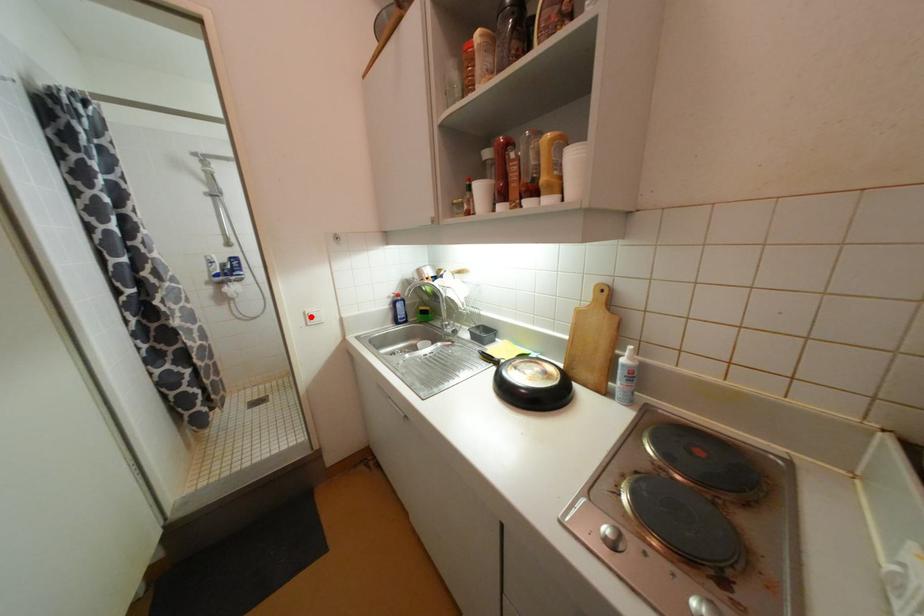
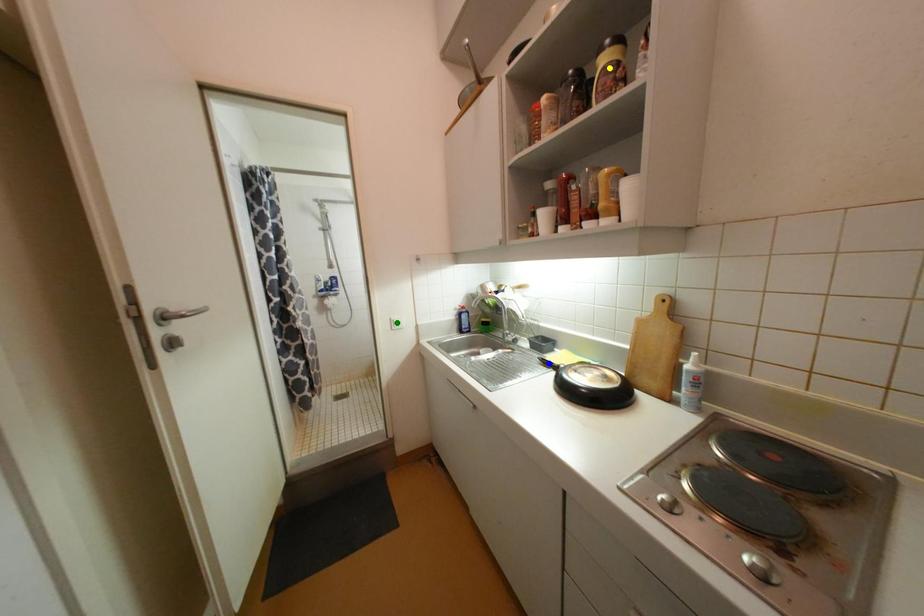
Question: I am providing you with two images of the same scene from different viewpoints. A red point is marked on the first image. You are given multiple points on the second image. Which point in image 2 is actually the same real-world point as the red point in image 1?

Choices:
 (A) yellow point
 (B) green point
 (C) blue point

Answer: (B)